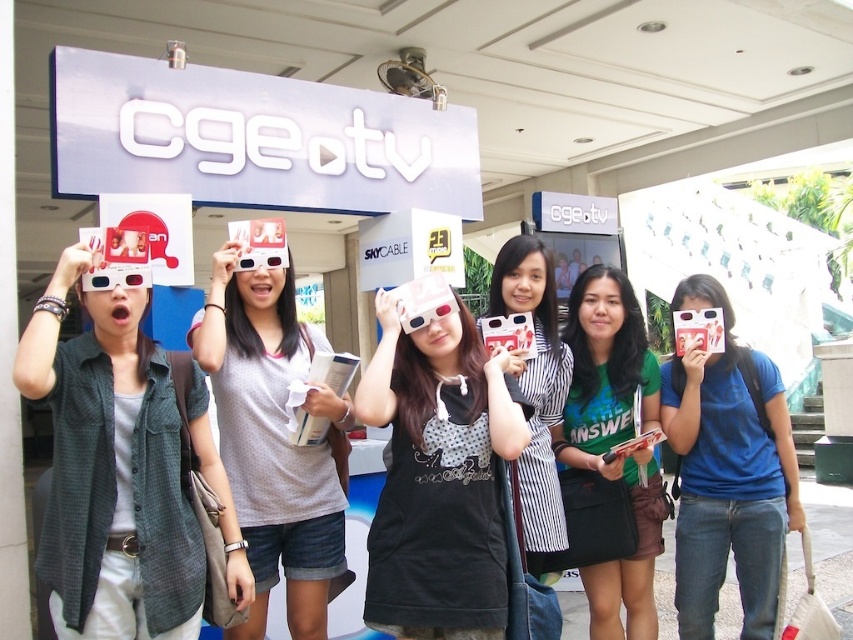
Describe the element at coordinates (727, 472) in the screenshot. This screenshot has height=640, width=853. I see `blue cotton shirt at center` at that location.

Is blue cotton shirt at center positioned before striped fabric dress at center?

No, blue cotton shirt at center is behind striped fabric dress at center.

Is point (775, 460) closer to camera compared to point (553, 506)?

No.

Image resolution: width=853 pixels, height=640 pixels. Find the location of `blue cotton shirt at center`. blue cotton shirt at center is located at coordinates (727, 472).

In the scene shown: Who is more distant from viewer, (439,477) or (701,540)?

Point (701,540)

Can you confirm if matte black dress at center is positioned to the left of blue cotton shirt at center?

Yes, matte black dress at center is to the left of blue cotton shirt at center.

Which is in front, point (492, 577) or point (701, 563)?

Point (492, 577) is more forward.

This screenshot has width=853, height=640. In order to click on matte black dress at center in this screenshot , I will do `click(439, 476)`.

Can you confirm if green checkered shirt at left is positioned to the right of striped fabric dress at center?

In fact, green checkered shirt at left is to the left of striped fabric dress at center.

Does green checkered shirt at left lie behind striped fabric dress at center?

No, it is in front of striped fabric dress at center.

Identify the location of green checkered shirt at left. This screenshot has height=640, width=853. (111, 468).

The image size is (853, 640). I want to click on green checkered shirt at left, so click(x=111, y=468).